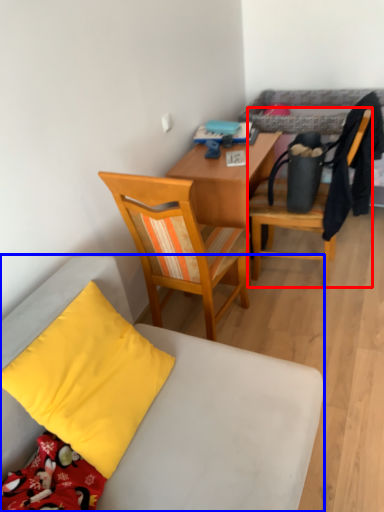
Question: Which point is further to the camera, chair (highlighted by a red box) or chair (highlighted by a blue box)?

Choices:
 (A) chair
 (B) chair

Answer: (A)